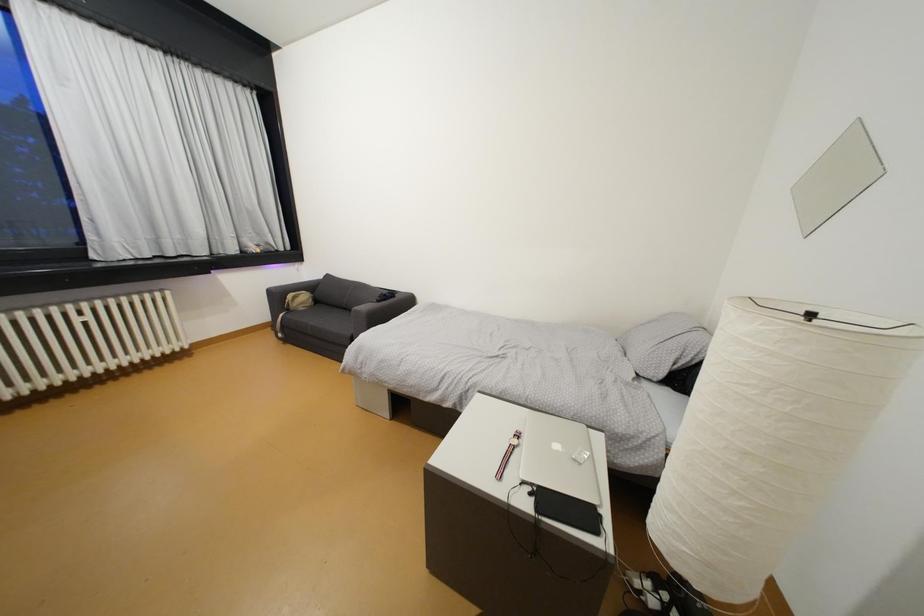
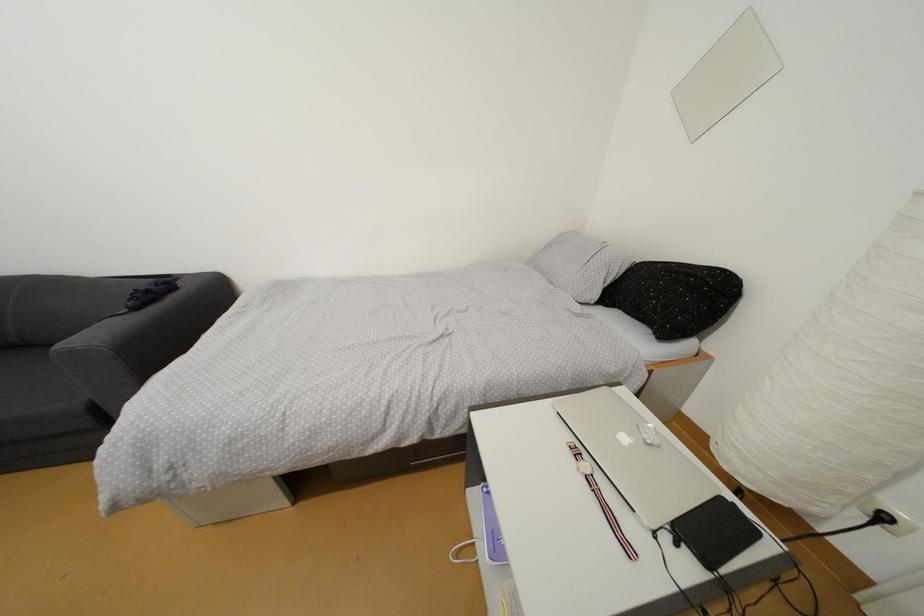
First-person continuous shooting, in which direction is the camera rotating?

The camera's rotation is toward right-down.